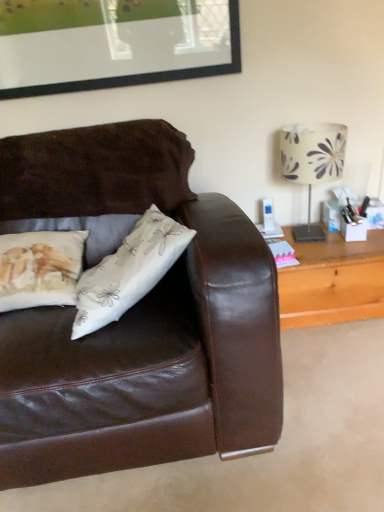
Question: Can you confirm if wooden table at right is smaller than white floral-patterned lampshade at upper right?

Choices:
 (A) yes
 (B) no

Answer: (B)

Question: Considering the relative sizes of wooden table at right and white floral-patterned lampshade at upper right in the image provided, is wooden table at right thinner than white floral-patterned lampshade at upper right?

Choices:
 (A) no
 (B) yes

Answer: (A)

Question: Is wooden table at right to the left of white floral-patterned lampshade at upper right from the viewer's perspective?

Choices:
 (A) no
 (B) yes

Answer: (A)

Question: From the image's perspective, is wooden table at right on white floral-patterned lampshade at upper right?

Choices:
 (A) no
 (B) yes

Answer: (A)

Question: Are wooden table at right and white floral-patterned lampshade at upper right far apart?

Choices:
 (A) yes
 (B) no

Answer: (B)

Question: Is wooden table at right directly adjacent to white floral-patterned lampshade at upper right?

Choices:
 (A) no
 (B) yes

Answer: (A)

Question: Considering the relative positions of white floral-patterned lampshade at upper right and wooden table at right in the image provided, is white floral-patterned lampshade at upper right behind wooden table at right?

Choices:
 (A) yes
 (B) no

Answer: (B)

Question: From a real-world perspective, is white floral-patterned lampshade at upper right physically below wooden table at right?

Choices:
 (A) no
 (B) yes

Answer: (A)

Question: Is white floral-patterned lampshade at upper right outside of wooden table at right?

Choices:
 (A) no
 (B) yes

Answer: (B)

Question: Considering the relative sizes of white floral-patterned lampshade at upper right and wooden table at right in the image provided, is white floral-patterned lampshade at upper right thinner than wooden table at right?

Choices:
 (A) no
 (B) yes

Answer: (B)

Question: Would you consider white floral-patterned lampshade at upper right to be distant from wooden table at right?

Choices:
 (A) no
 (B) yes

Answer: (A)

Question: Considering the relative positions of white floral-patterned lampshade at upper right and wooden table at right in the image provided, is white floral-patterned lampshade at upper right in front of wooden table at right?

Choices:
 (A) yes
 (B) no

Answer: (A)

Question: Considering their positions, is white floral-patterned lampshade at upper right located in front of or behind wooden table at right?

Choices:
 (A) behind
 (B) front

Answer: (B)